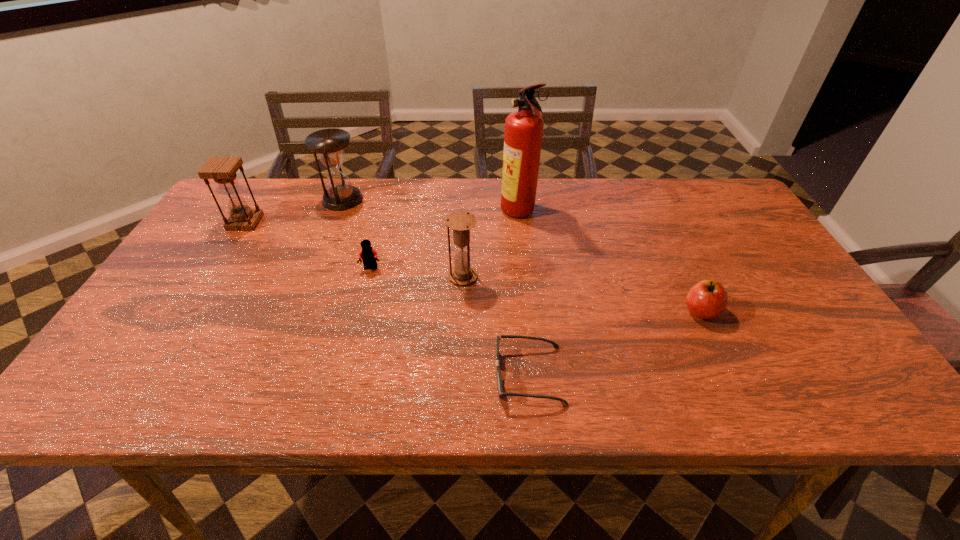
The width and height of the screenshot is (960, 540). Identify the location of unoccupied position between the second nearest hourglass and the shortest object. (387, 299).

Choose which object is the third nearest neighbor to the fourth object from right to left. Please provide its 2D coordinates. Your answer should be formatted as a tuple, i.e. [(x, y)], where the tuple contains the x and y coordinates of a point satisfying the conditions above.

[(499, 381)]

Image resolution: width=960 pixels, height=540 pixels. What are the coordinates of `object that can be found as the second closest to the fourth object from left to right` in the screenshot? It's located at (523, 134).

Point out which hourglass is positioned as the nearest to the rightmost hourglass. Please provide its 2D coordinates. Your answer should be formatted as a tuple, i.e. [(x, y)], where the tuple contains the x and y coordinates of a point satisfying the conditions above.

[(329, 144)]

Find the location of a particular element. The image size is (960, 540). hourglass that stands as the second closest to the tallest object is located at coordinates (329, 144).

At what (x,y) coordinates should I click in order to perform the action: click on free location that satisfies the following two spatial constraints: 1. on the front-facing side of the fire extinguisher; 2. on the back side of the rightmost object. Please return your answer as a coordinate pair (x, y). Looking at the image, I should click on (530, 311).

What are the coordinates of `vacant space that satisfies the following two spatial constraints: 1. on the front-facing side of the fifth object from right to left; 2. on the right side of the apple` in the screenshot? It's located at (360, 311).

The width and height of the screenshot is (960, 540). I want to click on free location that satisfies the following two spatial constraints: 1. on the front-facing side of the Lego; 2. on the left side of the fourth object from left to right, so click(x=369, y=276).